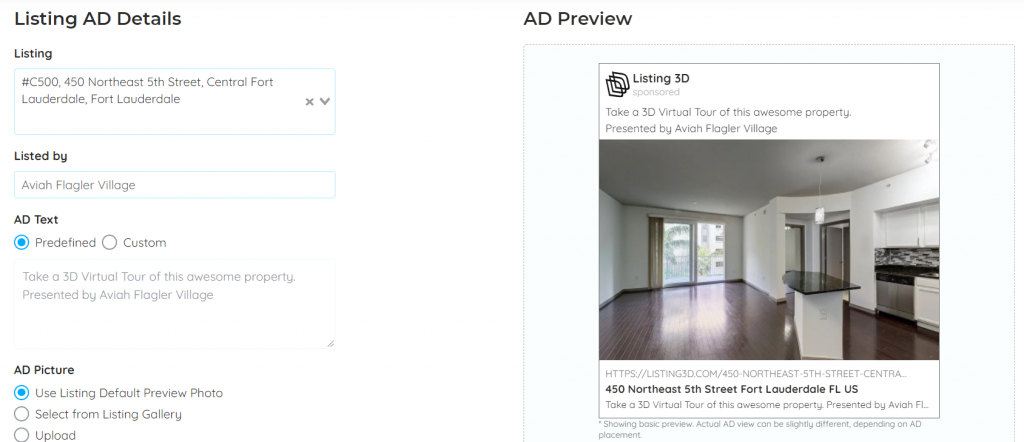
At what (x,y) coordinates should I click in order to perform the action: click on cabinets. Please return your answer as a coordinate pair (x, y). Looking at the image, I should click on (900, 226), (923, 229), (931, 300).